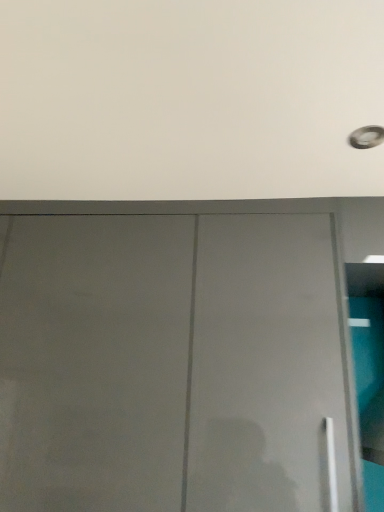
Measure the distance between matte gray door at center and camera.

The distance of matte gray door at center from camera is 39.21 inches.

The image size is (384, 512). Describe the element at coordinates (173, 364) in the screenshot. I see `matte gray door at center` at that location.

Locate an element on the screen. matte gray door at center is located at coordinates (173, 364).

Where is `matte gray door at center`? matte gray door at center is located at coordinates (173, 364).